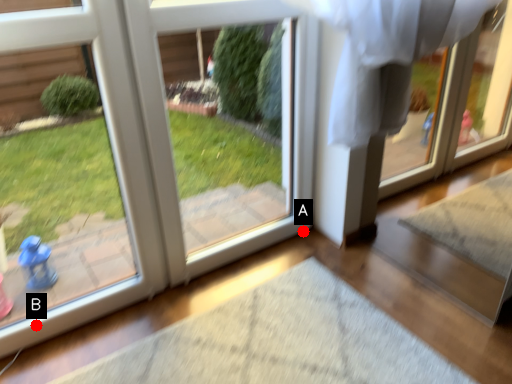
Question: Two points are circled on the image, labeled by A and B beside each circle. Which of the following is the farthest from the observer?

Choices:
 (A) A is further
 (B) B is further

Answer: (A)